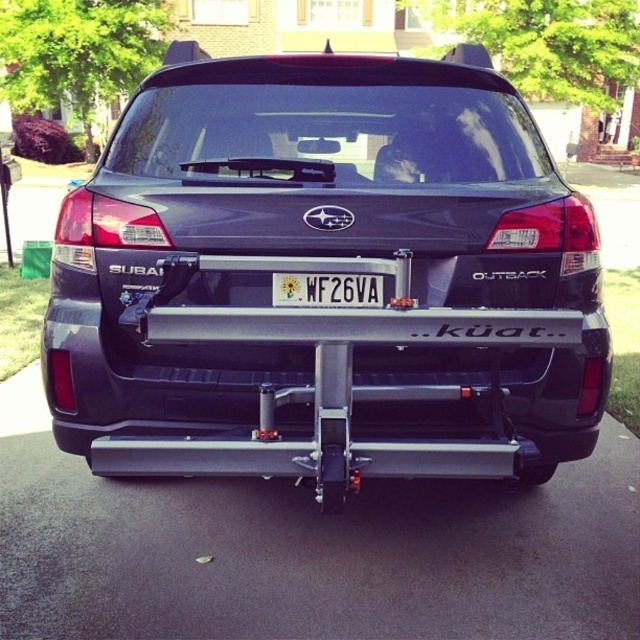
Is metallic gray hitch at center thinner than white plastic license plate at center?

In fact, metallic gray hitch at center might be wider than white plastic license plate at center.

Does metallic gray hitch at center have a greater width compared to white plastic license plate at center?

Yes, metallic gray hitch at center is wider than white plastic license plate at center.

Between point (502, 348) and point (298, 291), which one is positioned behind?

Point (502, 348)

Locate an element on the screen. Image resolution: width=640 pixels, height=640 pixels. metallic gray hitch at center is located at coordinates (324, 273).